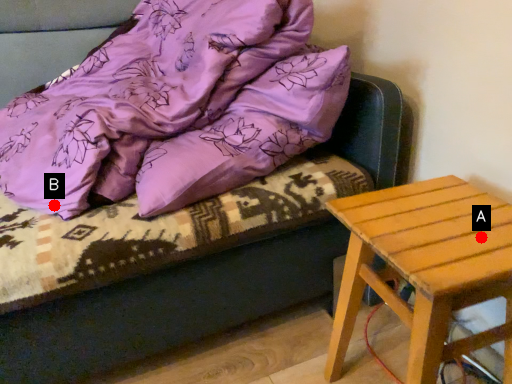
Question: Two points are circled on the image, labeled by A and B beside each circle. Which point is further to the camera?

Choices:
 (A) A is further
 (B) B is further

Answer: (B)